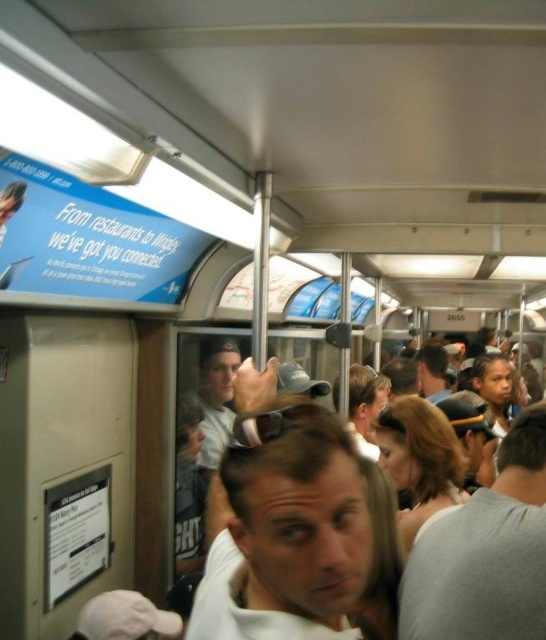
Question: Does light brown leather jacket at center lie behind matte gray shirt at center?

Choices:
 (A) yes
 (B) no

Answer: (B)

Question: Which of these objects is positioned closest to the light brown leather jacket at center?

Choices:
 (A) white matte shirt at center
 (B) gray cotton shirt at center
 (C) matte gray shirt at center

Answer: (C)

Question: Which point is farther to the camera?

Choices:
 (A) light brown leather jacket at center
 (B) gray cotton shirt at center
 (C) matte gray shirt at center
 (D) white matte shirt at center

Answer: (C)

Question: Which object is the closest to the gray cotton shirt at center?

Choices:
 (A) matte gray shirt at center
 (B) white matte shirt at center

Answer: (B)

Question: Can you confirm if light brown leather jacket at center is positioned above matte gray shirt at center?

Choices:
 (A) no
 (B) yes

Answer: (A)

Question: Can you confirm if gray cotton shirt at center is bigger than light brown leather jacket at center?

Choices:
 (A) yes
 (B) no

Answer: (B)